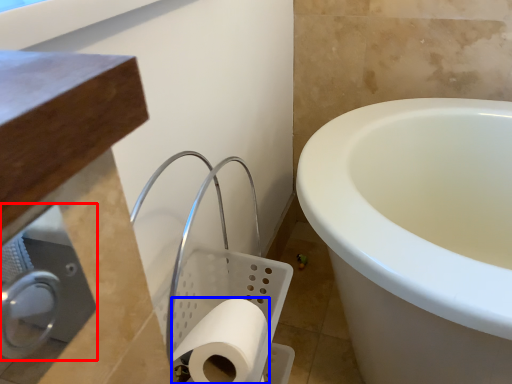
Question: Among these objects, which one is farthest to the camera, dispenser (highlighted by a red box) or toilet paper (highlighted by a blue box)?

Choices:
 (A) dispenser
 (B) toilet paper

Answer: (B)